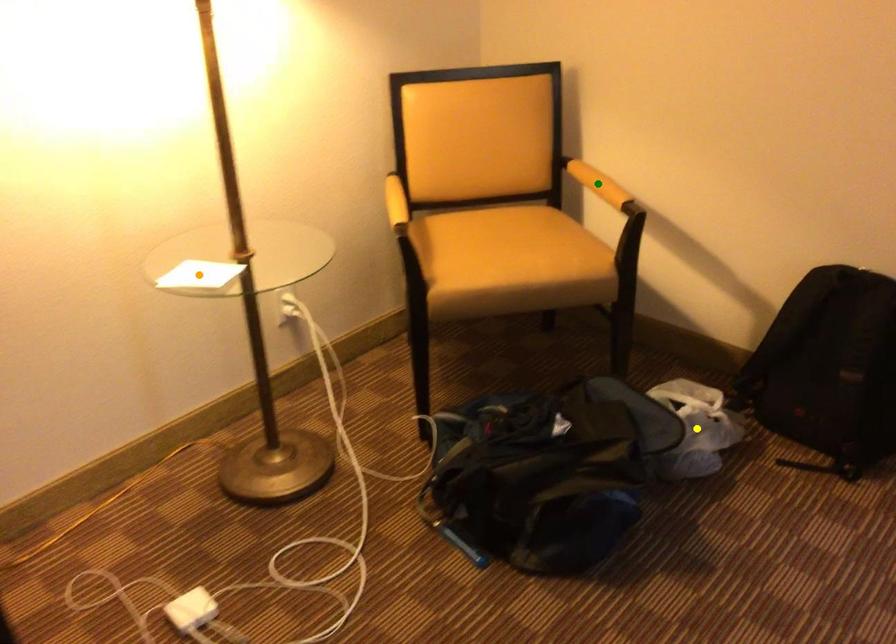
Order these from nearest to farthest:
A) green point
B) yellow point
C) orange point

orange point, yellow point, green point